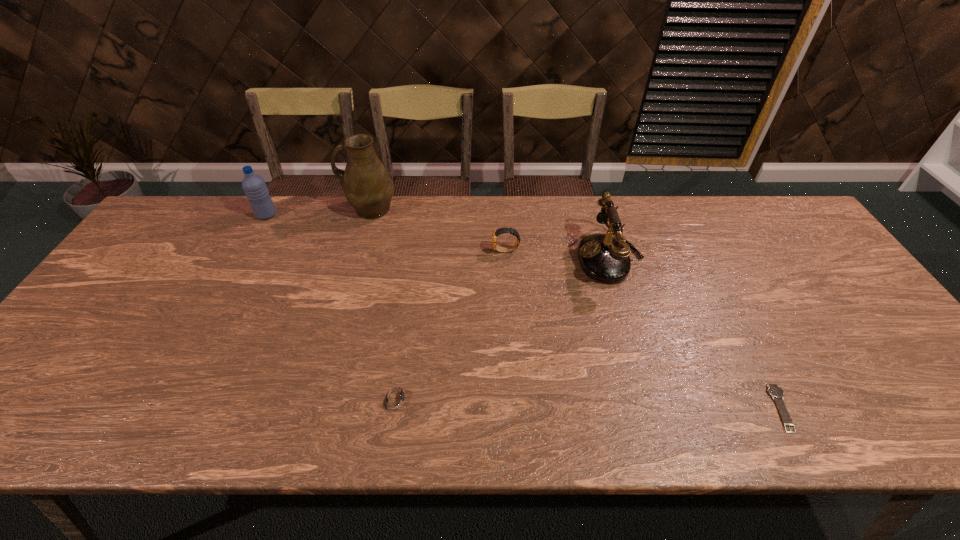
This screenshot has height=540, width=960. I want to click on vacant space at the near left corner of the desktop, so click(23, 403).

In order to click on free space at the far right corner in this screenshot , I will do `click(775, 214)`.

Identify the location of vacant area that lies between the telephone and the fourth object from right to left. (503, 327).

Image resolution: width=960 pixels, height=540 pixels. What are the coordinates of `unoccupied position between the telephone and the tallest object` in the screenshot? It's located at click(x=490, y=233).

Image resolution: width=960 pixels, height=540 pixels. I want to click on vacant point located between the water bottle and the second object from right to left, so click(439, 236).

At what (x,y) coordinates should I click in order to perform the action: click on free spot between the fourth object from right to left and the farthest watch. Please return your answer as a coordinate pair (x, y). This screenshot has height=540, width=960. Looking at the image, I should click on (451, 325).

You are a GUI agent. You are given a task and a screenshot of the screen. Output one action in this format:
    pyautogui.click(x=<x>, y=<y>)
    Task: Click on the free space between the shortest watch and the water bottle
    Image resolution: width=960 pixels, height=540 pixels.
    Given the screenshot: What is the action you would take?
    pyautogui.click(x=524, y=312)

At what (x,y) coordinates should I click in order to perform the action: click on free space between the second tallest watch and the fifth object from left to right. Please return your answer as a coordinate pair (x, y). This screenshot has width=960, height=540. Looking at the image, I should click on (503, 327).

At what (x,y) coordinates should I click in order to perform the action: click on vacant area that lies between the water bottle and the fourth tallest object. Please return your answer as a coordinate pair (x, y). The height and width of the screenshot is (540, 960). Looking at the image, I should click on (386, 233).

Identify the location of unoccupied area between the tallest object and the telephone. (490, 233).